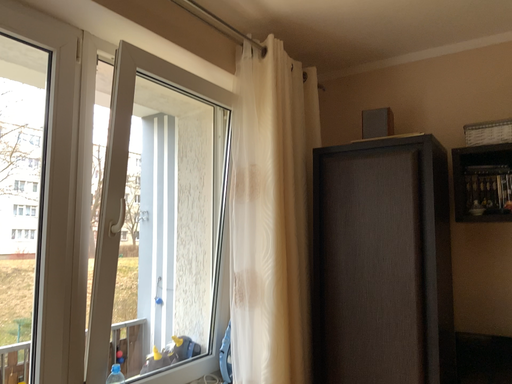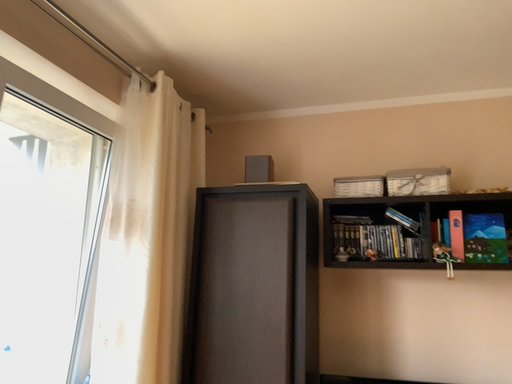
Question: How did the camera likely rotate when shooting the video?

Choices:
 (A) rotated left
 (B) rotated right

Answer: (B)